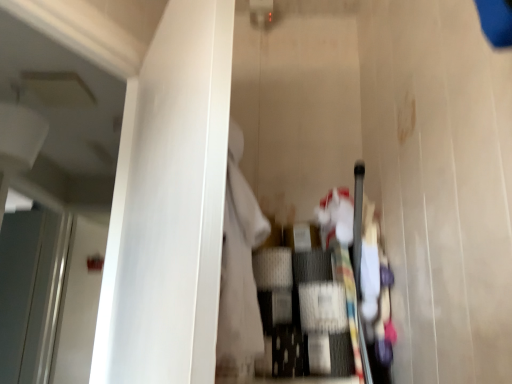
Describe the element at coordinates (79, 303) in the screenshot. The height and width of the screenshot is (384, 512). I see `white glossy door at left` at that location.

In order to face white glossy door at left, should I rotate leftwards or rightwards?

To align with it, rotate left about 22.118°.

Locate an element on the screen. white glossy door at left is located at coordinates (79, 303).

Identify the location of white glossy door at left. (79, 303).